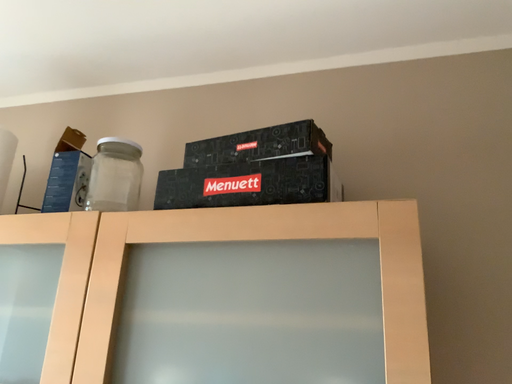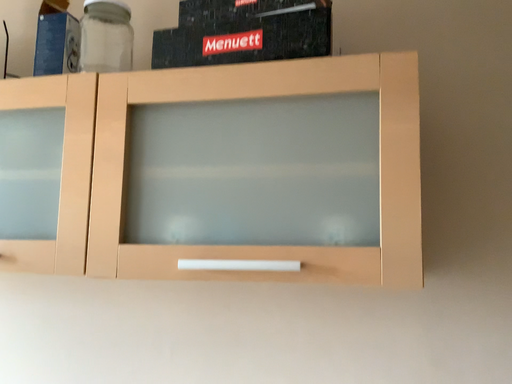
Question: Which way did the camera rotate in the video?

Choices:
 (A) rotated upward
 (B) rotated downward

Answer: (B)